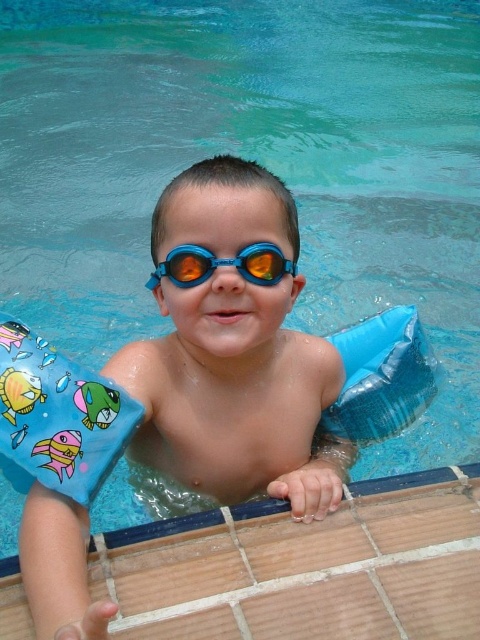
Question: Among these points, which one is farthest from the camera?

Choices:
 (A) (50, 528)
 (B) (202, 250)

Answer: (B)

Question: Is blue rubber arm float at center wider than blue rubber goggles at center?

Choices:
 (A) no
 (B) yes

Answer: (B)

Question: Is blue rubber arm float at center closer to the viewer compared to blue rubber goggles at center?

Choices:
 (A) yes
 (B) no

Answer: (A)

Question: Which point is closer to the camera?

Choices:
 (A) (324, 384)
 (B) (248, 260)

Answer: (B)

Question: Which object appears closest to the camera in this image?

Choices:
 (A) blue rubber arm float at center
 (B) blue rubber goggles at center

Answer: (A)

Question: Can you confirm if blue rubber arm float at center is wider than blue rubber goggles at center?

Choices:
 (A) yes
 (B) no

Answer: (A)